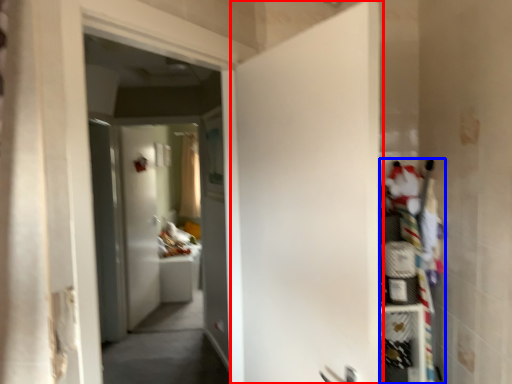
Question: Among these objects, which one is farthest to the camera, door (highlighted by a red box) or shelf (highlighted by a blue box)?

Choices:
 (A) door
 (B) shelf

Answer: (B)